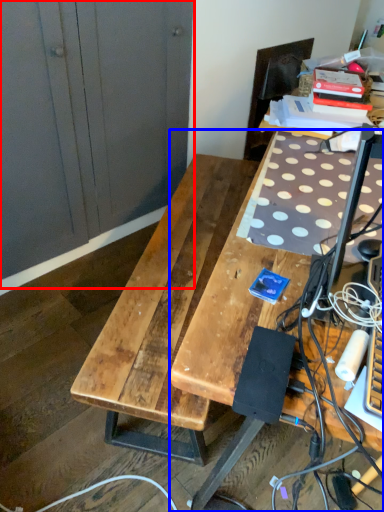
Question: Which point is closer to the camera, dresser (highlighted by a red box) or desk (highlighted by a blue box)?

Choices:
 (A) dresser
 (B) desk

Answer: (B)